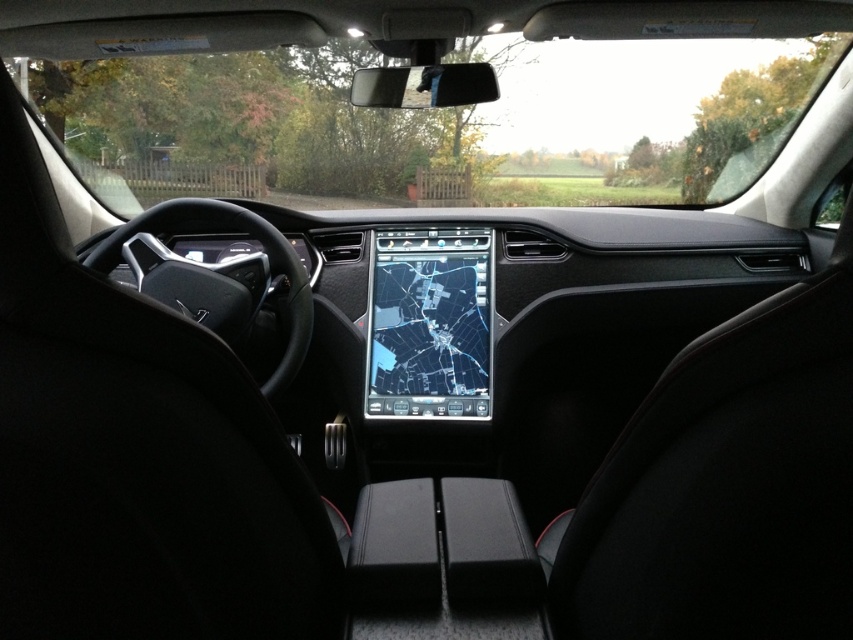
Does point (561, 65) lie behind point (465, 252)?

Yes, point (561, 65) is behind point (465, 252).

Between point (316, 138) and point (437, 332), which one is positioned behind?

Positioned behind is point (316, 138).

Image resolution: width=853 pixels, height=640 pixels. In order to click on transparent glass windshield at upper center in this screenshot , I will do `click(434, 122)`.